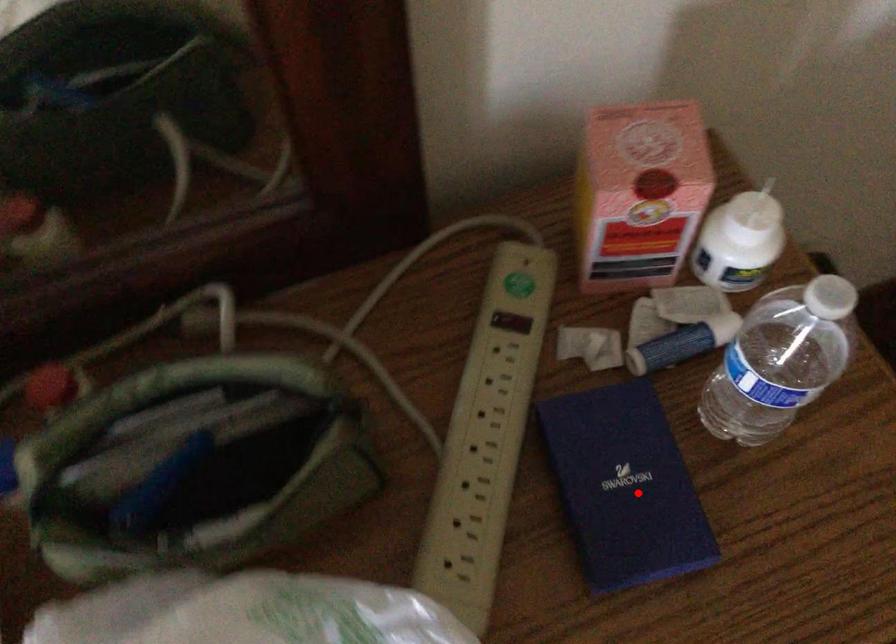
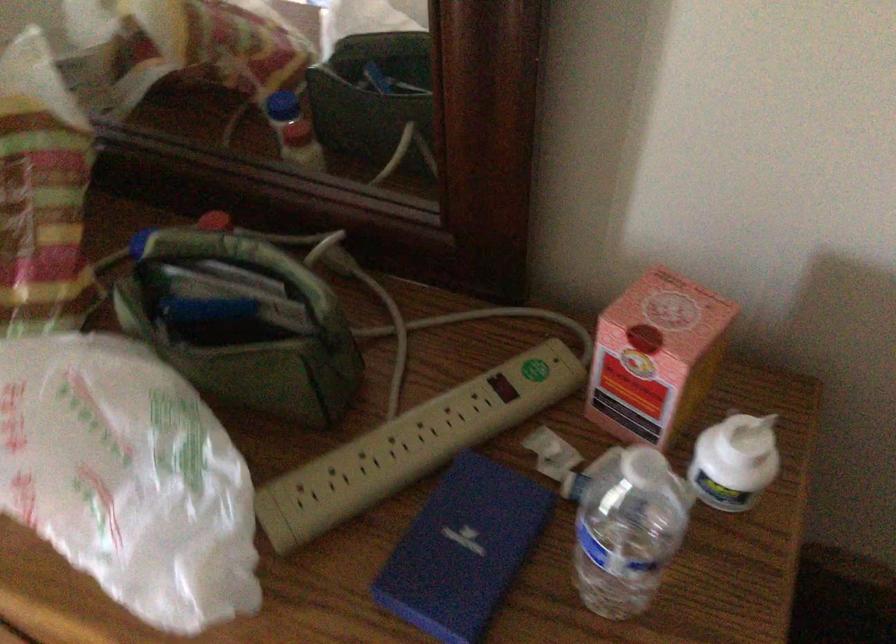
Question: I am providing you with two images of the same scene from different viewpoints. In image1, a red point is highlighted. Considering the same 3D point in image2, which of the following is correct?

Choices:
 (A) It is closer
 (B) It is farther

Answer: (B)